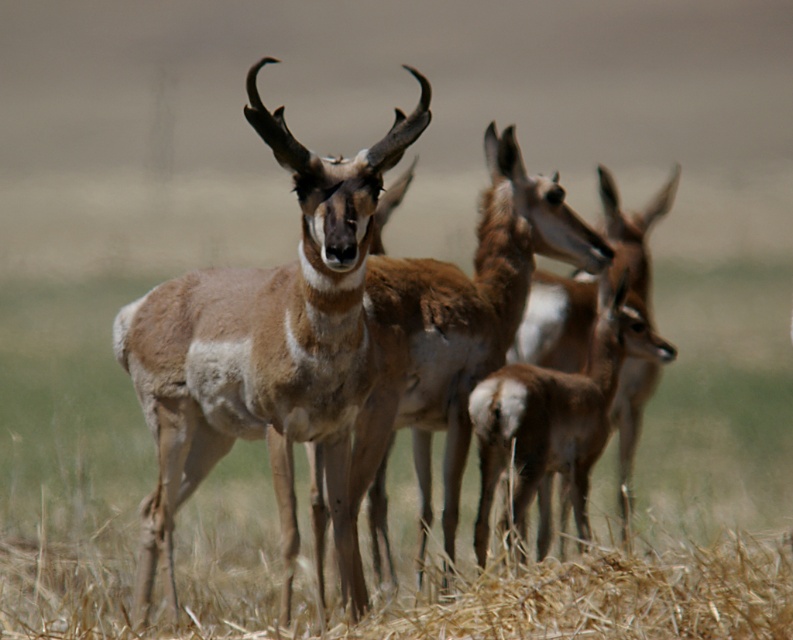
Looking at this image, you are a wildlife photographer aiming to capture a clear shot of both the brown fur antelope at center and the brown furry deer at center. Based on their positions, which one is positioned higher in the frame?

The brown fur antelope at center is positioned higher in the frame than the brown furry deer at center, as it is located above it.